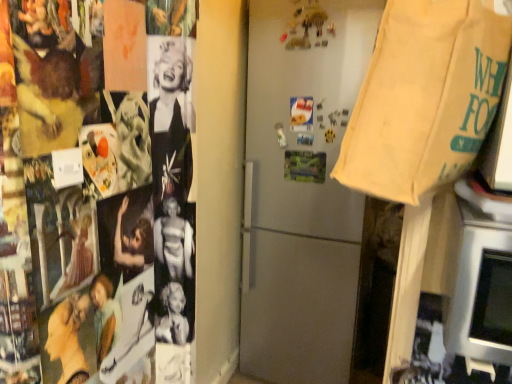
Question: Based on their sizes in the image, would you say satin silver refrigerator at center is bigger or smaller than silver metallic oven at lower right?

Choices:
 (A) big
 (B) small

Answer: (A)

Question: Is satin silver refrigerator at center wider or thinner than silver metallic oven at lower right?

Choices:
 (A) thin
 (B) wide

Answer: (B)

Question: Considering the real-world distances, which object is closest to the silver metallic oven at lower right?

Choices:
 (A) beige canvas grocery bag at upper right
 (B) satin silver refrigerator at center

Answer: (A)

Question: Which is nearer to the satin silver refrigerator at center?

Choices:
 (A) beige canvas grocery bag at upper right
 (B) silver metallic oven at lower right

Answer: (A)